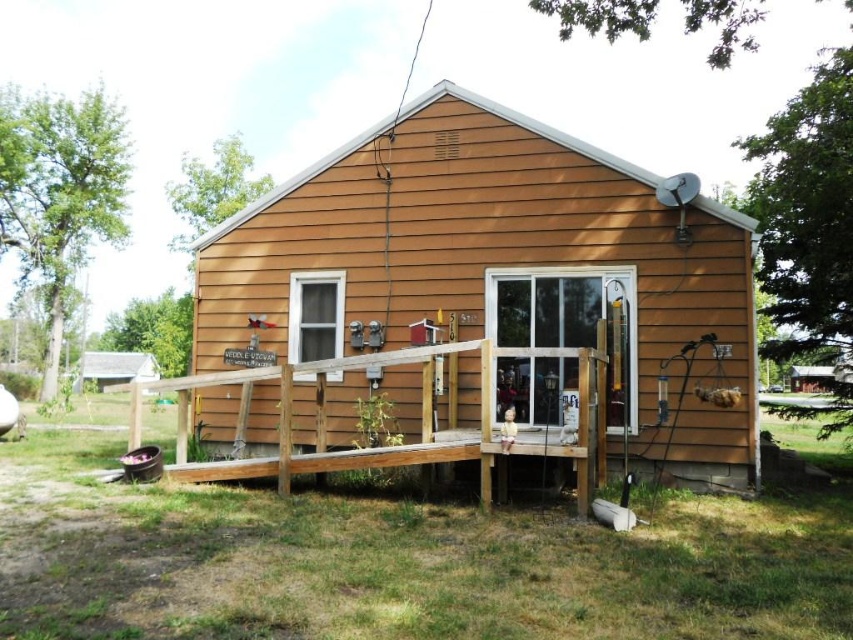
Does brown wood siding at center lie in front of brown wooden porch at center?

No, brown wood siding at center is behind brown wooden porch at center.

Measure the distance between point (239, 256) and camera.

They are 28.84 feet apart.

Who is more distant from viewer, (300, 209) or (218, 472)?

The point (300, 209) is behind.

Where is `brown wood siding at center`? Image resolution: width=853 pixels, height=640 pixels. brown wood siding at center is located at coordinates click(x=496, y=268).